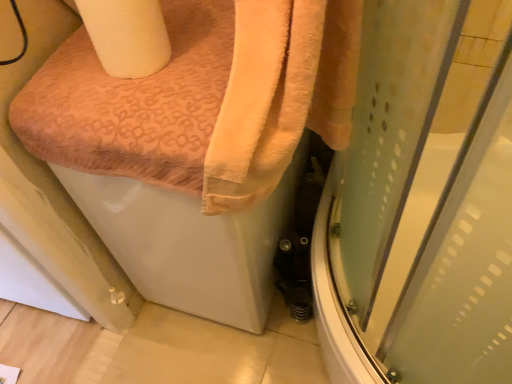
Find the location of `transparent plastic screen door at lower right`. transparent plastic screen door at lower right is located at coordinates (422, 202).

Where is `orange textured towel at upper left`? The width and height of the screenshot is (512, 384). orange textured towel at upper left is located at coordinates (227, 108).

In order to face orange textured towel at upper left, should I rotate leftwards or rightwards?

It's best to rotate left around 5.257 degrees.

Identify the location of transparent plastic screen door at lower right. (422, 202).

Is orange textured towel at upper left located within transparent plastic screen door at lower right?

No, orange textured towel at upper left is not a part of transparent plastic screen door at lower right.

Looking at this image, could you tell me if transparent plastic screen door at lower right is turned towards orange textured towel at upper left?

Yes, transparent plastic screen door at lower right is oriented towards orange textured towel at upper left.

You are a GUI agent. You are given a task and a screenshot of the screen. Output one action in this format:
    pyautogui.click(x=<x>, y=<y>)
    Task: Click on the screen door that is in front of the orange textured towel at upper left
    The image size is (512, 384).
    Given the screenshot: What is the action you would take?
    pyautogui.click(x=422, y=202)

Can you confirm if transparent plastic screen door at lower right is positioned to the left of orange textured towel at upper left?

No, transparent plastic screen door at lower right is not to the left of orange textured towel at upper left.

Is orange textured towel at upper left placed right next to white matte toilet paper at upper left?

No, orange textured towel at upper left is not making contact with white matte toilet paper at upper left.

From the image's perspective, is orange textured towel at upper left above white matte toilet paper at upper left?

No, from the image's perspective, orange textured towel at upper left is not on top of white matte toilet paper at upper left.

From a real-world perspective, between orange textured towel at upper left and white matte toilet paper at upper left, who is vertically higher?

white matte toilet paper at upper left, from a real-world perspective.

In terms of width, does white matte toilet paper at upper left look wider or thinner when compared to orange textured towel at upper left?

Considering their sizes, white matte toilet paper at upper left looks slimmer than orange textured towel at upper left.

Is the surface of white matte toilet paper at upper left in direct contact with orange textured towel at upper left?

No, white matte toilet paper at upper left is not next to orange textured towel at upper left.

The image size is (512, 384). I want to click on toilet paper above the orange textured towel at upper left (from a real-world perspective), so click(x=127, y=35).

Can you tell me how much white matte toilet paper at upper left and orange soft towel at upper left differ in facing direction?

They differ by 0.00109 degrees in their facing directions.

Would you say white matte toilet paper at upper left is a long distance from orange soft towel at upper left?

No, white matte toilet paper at upper left is not far from orange soft towel at upper left.

Could you tell me if white matte toilet paper at upper left is turned towards orange soft towel at upper left?

No.

Between white matte toilet paper at upper left and orange soft towel at upper left, which one has larger width?

orange soft towel at upper left.

Is orange soft towel at upper left facing towards transparent plastic screen door at lower right?

No, orange soft towel at upper left is not oriented towards transparent plastic screen door at lower right.

Based on the photo, from the image's perspective, which is above, orange soft towel at upper left or transparent plastic screen door at lower right?

orange soft towel at upper left is shown above in the image.

Locate an element on the screen. screen door in front of the orange soft towel at upper left is located at coordinates (422, 202).

Looking at their sizes, would you say orange soft towel at upper left is wider or thinner than orange textured towel at upper left?

Considering their sizes, orange soft towel at upper left looks slimmer than orange textured towel at upper left.

Is orange soft towel at upper left next to orange textured towel at upper left and touching it?

Yes, orange soft towel at upper left is with orange textured towel at upper left.

Is point (256, 8) less distant than point (205, 201)?

Yes, point (256, 8) is closer to viewer.

Measure the distance between orange soft towel at upper left and orange textured towel at upper left.

2.13 inches.

Which is more to the left, white matte toilet paper at upper left or transparent plastic screen door at lower right?

From the viewer's perspective, white matte toilet paper at upper left appears more on the left side.

In the scene shown: Between white matte toilet paper at upper left and transparent plastic screen door at lower right, which one has larger size?

Bigger between the two is transparent plastic screen door at lower right.

Is white matte toilet paper at upper left positioned with its back to transparent plastic screen door at lower right?

white matte toilet paper at upper left is not turned away from transparent plastic screen door at lower right.

Which object is wider, white matte toilet paper at upper left or transparent plastic screen door at lower right?

transparent plastic screen door at lower right is wider.

Locate an element on the screen. screen door on the right of the orange textured towel at upper left is located at coordinates (422, 202).

This screenshot has height=384, width=512. What are the coordinates of `towel below the white matte toilet paper at upper left (from the image's perspective)` in the screenshot? It's located at coord(227,108).

When comparing their distances from white matte toilet paper at upper left, does orange soft towel at upper left or transparent plastic screen door at lower right seem closer?

orange soft towel at upper left.

When comparing their distances from orange textured towel at upper left, does orange soft towel at upper left or transparent plastic screen door at lower right seem closer?

Among the two, orange soft towel at upper left is located nearer to orange textured towel at upper left.

Based on their spatial positions, is white matte toilet paper at upper left or orange soft towel at upper left further from transparent plastic screen door at lower right?

white matte toilet paper at upper left is positioned further to the anchor transparent plastic screen door at lower right.

When comparing their distances from orange soft towel at upper left, does transparent plastic screen door at lower right or white matte toilet paper at upper left seem closer?

white matte toilet paper at upper left is positioned closer to the anchor orange soft towel at upper left.

Estimate the real-world distances between objects in this image. Which object is further from orange textured towel at upper left, white matte toilet paper at upper left or orange soft towel at upper left?

white matte toilet paper at upper left is further to orange textured towel at upper left.

Considering their positions, is orange soft towel at upper left positioned closer to transparent plastic screen door at lower right than white matte toilet paper at upper left?

Based on the image, orange soft towel at upper left appears to be nearer to transparent plastic screen door at lower right.

Estimate the real-world distances between objects in this image. Which object is closer to transparent plastic screen door at lower right, orange soft towel at upper left or orange textured towel at upper left?

orange soft towel at upper left is positioned closer to the anchor transparent plastic screen door at lower right.

From the image, which object appears to be farther from white matte toilet paper at upper left, orange textured towel at upper left or orange soft towel at upper left?

orange soft towel at upper left.

The height and width of the screenshot is (384, 512). What are the coordinates of `bath towel between white matte toilet paper at upper left and transparent plastic screen door at lower right` in the screenshot? It's located at (280, 94).

The width and height of the screenshot is (512, 384). Identify the location of bath towel between transparent plastic screen door at lower right and orange textured towel at upper left in the front-back direction. (280, 94).

Identify the location of towel between white matte toilet paper at upper left and transparent plastic screen door at lower right. The height and width of the screenshot is (384, 512). coord(227,108).

Find the location of a particular element. The width and height of the screenshot is (512, 384). towel situated between white matte toilet paper at upper left and orange soft towel at upper left from left to right is located at coordinates (227, 108).